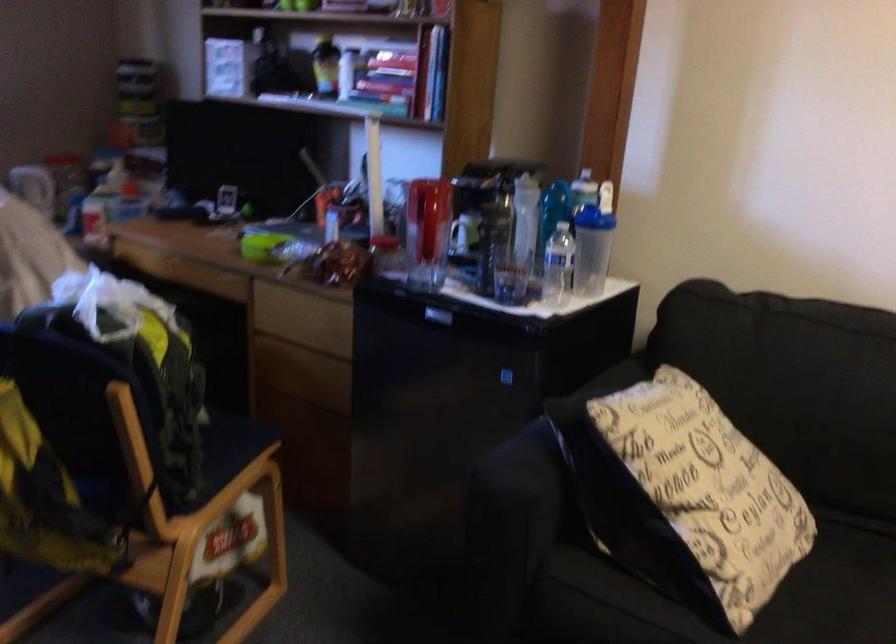
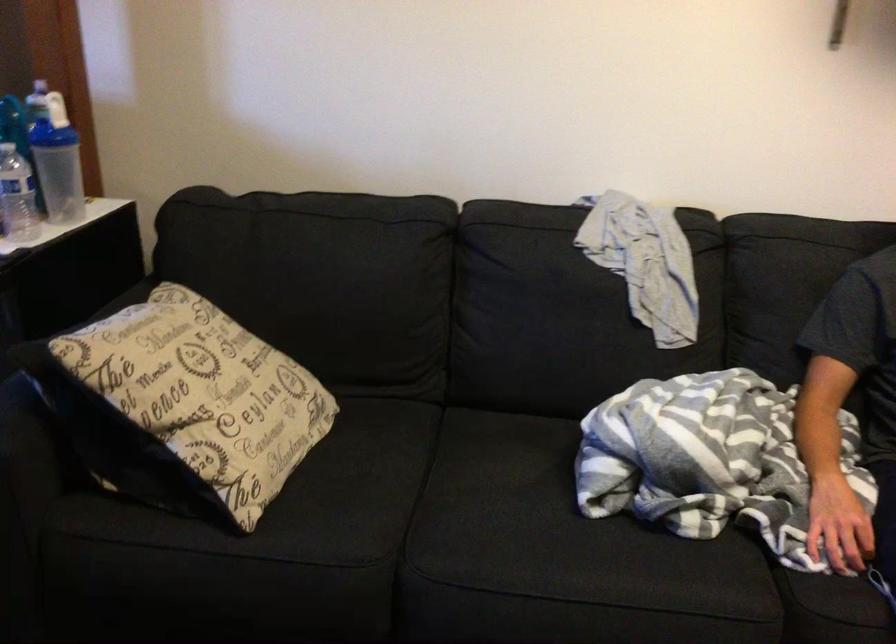
Where in the second image is the point corresponding to (x=693, y=491) from the first image?

(186, 406)